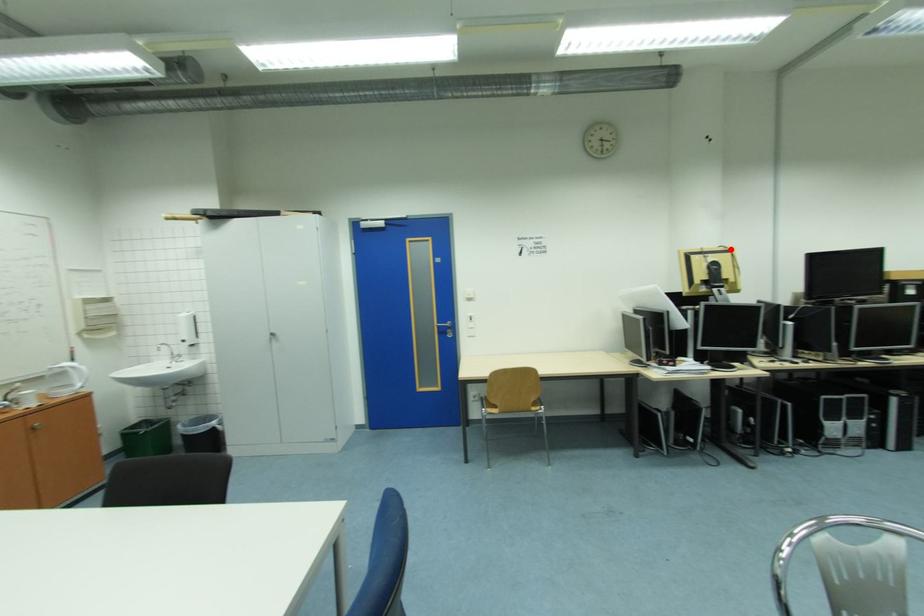
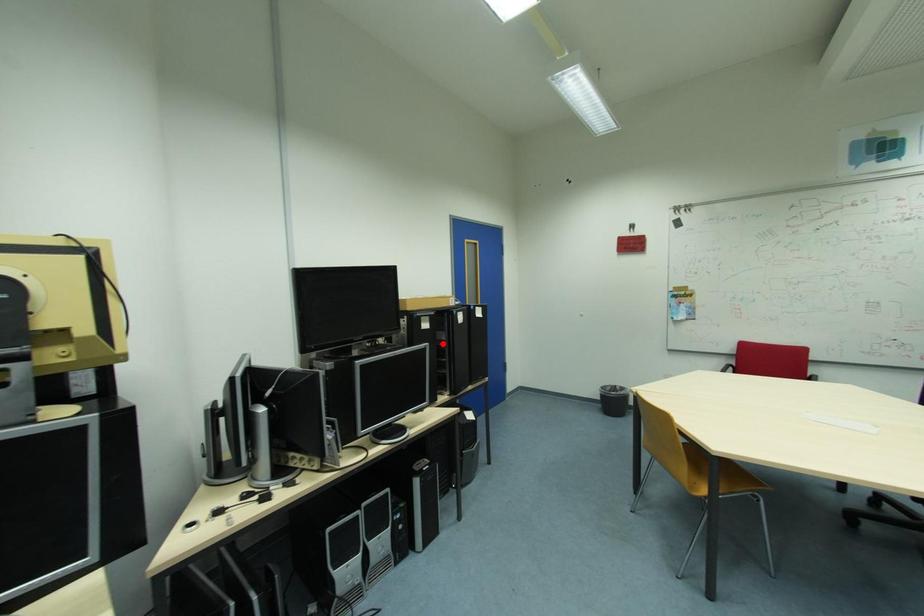
I am providing you with two images of the same scene from different viewpoints. A red point is marked on the first image and another point is marked on the second image. Is the red point in image1 aligned with the point shown in image2?

No